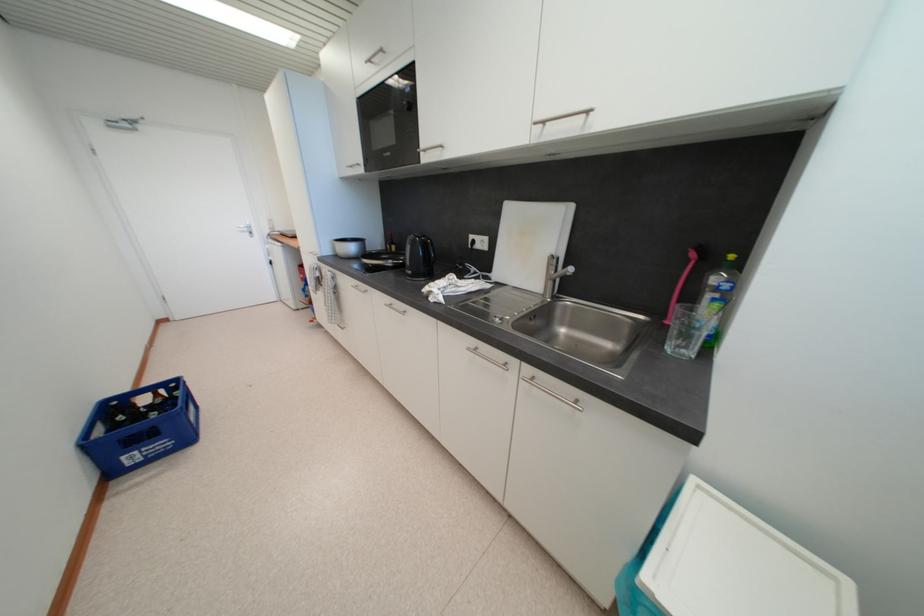
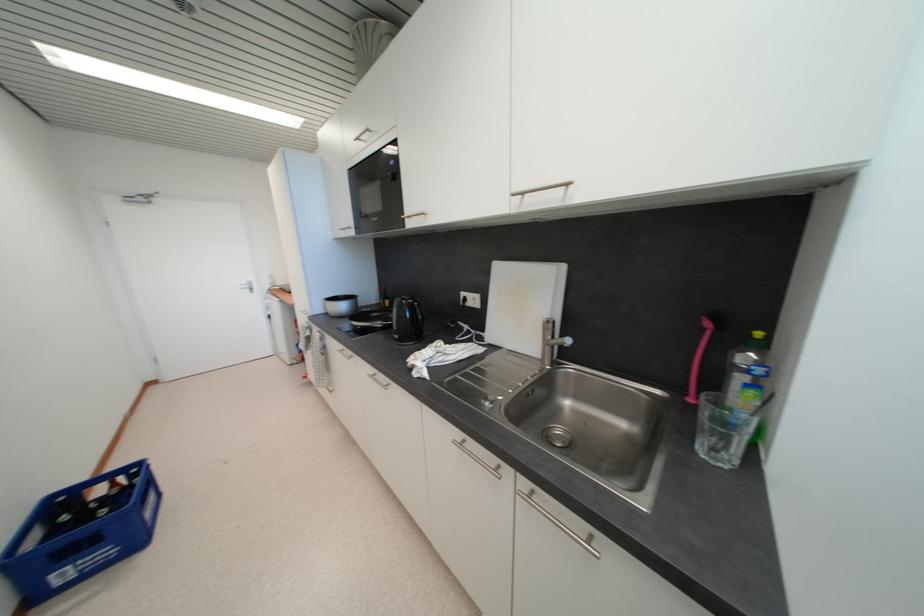
The point at [573,276] is marked in the first image. Where is the corresponding point in the second image?

(570, 347)